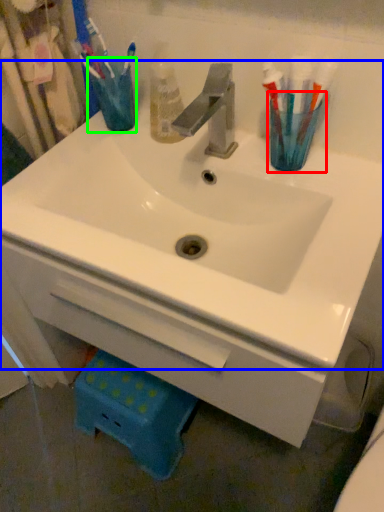
Question: Estimate the real-world distances between objects in this image. Which object is closer to turquoise (highlighted by a red box), sink (highlighted by a blue box) or turquoise (highlighted by a green box)?

Choices:
 (A) sink
 (B) turquoise

Answer: (A)